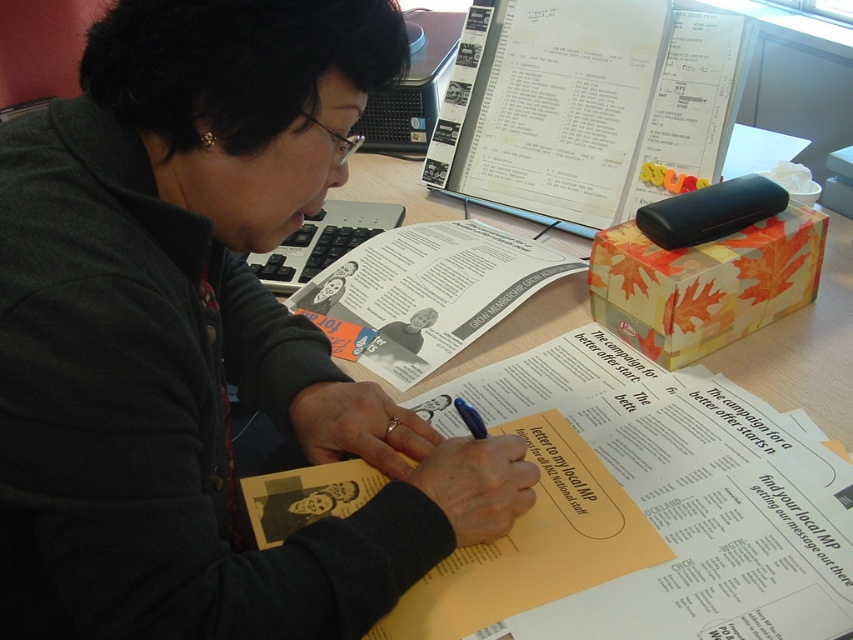
Question: Is wooden table at center further to the viewer compared to black plastic computer at upper center?

Choices:
 (A) yes
 (B) no

Answer: (B)

Question: Among these points, which one is nearest to the camera?

Choices:
 (A) (395, 97)
 (B) (387, 376)

Answer: (B)

Question: Is black plastic computer at upper center positioned before blue plastic pen at center?

Choices:
 (A) no
 (B) yes

Answer: (A)

Question: Which is farther from the matte black sweater at center?

Choices:
 (A) black plastic computer at upper center
 (B) wooden table at center

Answer: (A)

Question: Estimate the real-world distances between objects in this image. Which object is farther from the black plastic computer at upper center?

Choices:
 (A) matte black sweater at center
 (B) blue plastic pen at center

Answer: (B)

Question: Is wooden table at center thinner than black plastic computer at upper center?

Choices:
 (A) no
 (B) yes

Answer: (A)